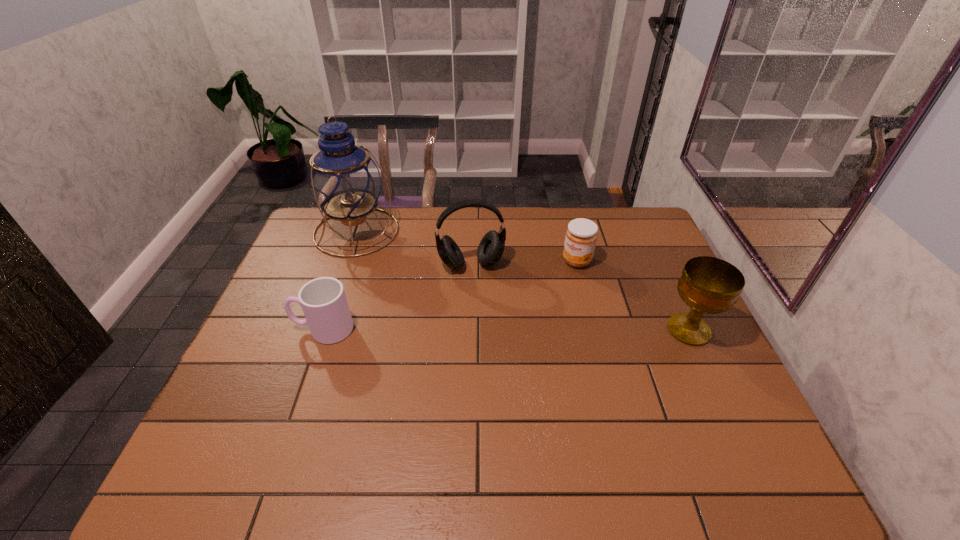
The width and height of the screenshot is (960, 540). Identify the location of free space on the desktop that is between the cup and the rightmost object and is positioned on the front label of the fourth object from left to right. (513, 329).

The height and width of the screenshot is (540, 960). What are the coordinates of `vacant space on the desktop that is between the cup and the rightmost object and is positioned on the ear cups of the third object from right to left` in the screenshot? It's located at (487, 329).

The image size is (960, 540). Identify the location of vacant space on the desktop that is between the cup and the rightmost object and is positioned on the front-facing side of the tallest object. pyautogui.click(x=458, y=329).